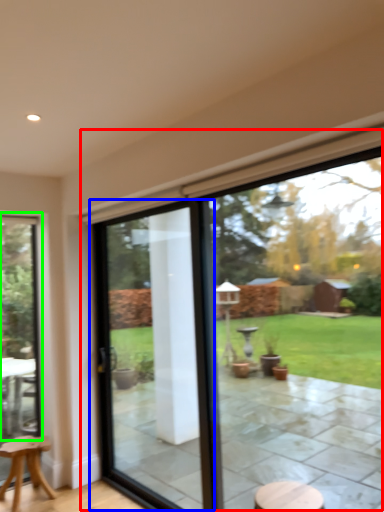
Question: Which object is positioned farthest from window (highlighted by a red box)? Select from screen door (highlighted by a blue box) and window (highlighted by a green box).

Choices:
 (A) screen door
 (B) window

Answer: (B)